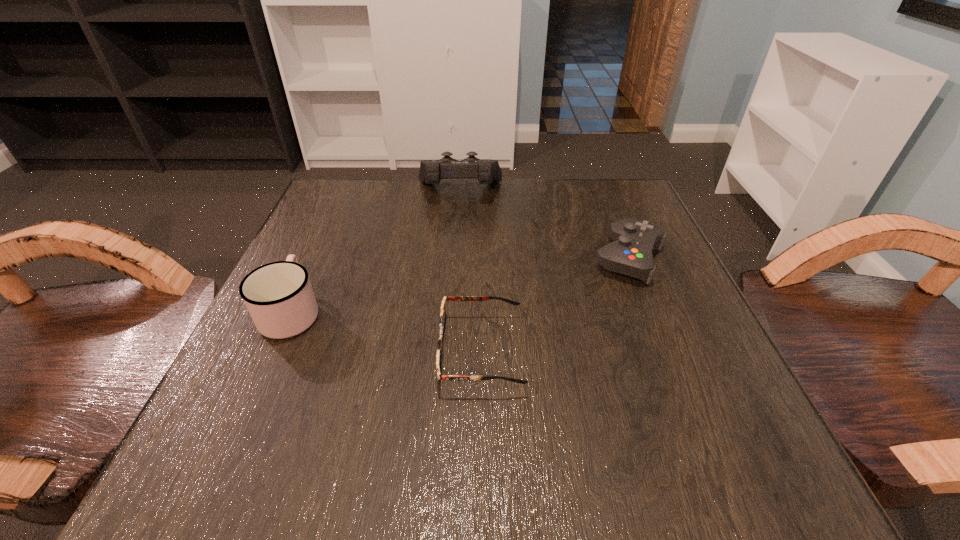
Where is `the left control`? the left control is located at coordinates (487, 171).

Where is `the taller control`? the taller control is located at coordinates (487, 171).

Locate an element on the screen. This screenshot has width=960, height=540. the leftmost object is located at coordinates (279, 297).

Find the location of `the right control`. the right control is located at coordinates (630, 254).

Where is `the shorter control`? The width and height of the screenshot is (960, 540). the shorter control is located at coordinates (630, 254).

Find the location of a particular element. the shortest object is located at coordinates (442, 322).

Locate an element on the screen. This screenshot has width=960, height=540. vacant space situated 0.130m on the right of the farthest object is located at coordinates (558, 191).

At what (x,y) coordinates should I click in order to perform the action: click on free space located on the side of the leftmost object with the handle. Please return your answer as a coordinate pair (x, y). The height and width of the screenshot is (540, 960). Looking at the image, I should click on (323, 242).

Where is `vacant space positioned 0.240m on the side of the leftmost object with the handle`? This screenshot has height=540, width=960. vacant space positioned 0.240m on the side of the leftmost object with the handle is located at coordinates 336,213.

You are a GUI agent. You are given a task and a screenshot of the screen. Output one action in this format:
    pyautogui.click(x=<x>, y=<y>)
    Task: Click on the vacant space located 0.220m on the side of the leftmost object with the handle
    The height and width of the screenshot is (540, 960).
    Given the screenshot: What is the action you would take?
    pyautogui.click(x=334, y=218)